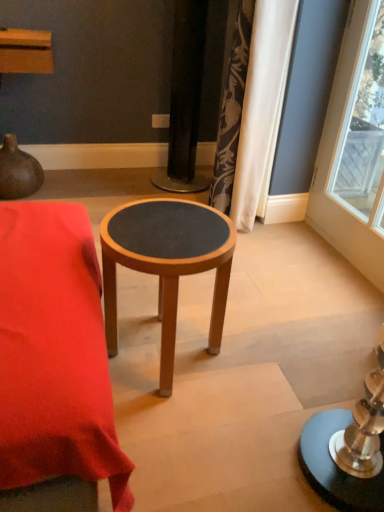
Identify the location of vacant space to the right of wooden stool at center. click(266, 360).